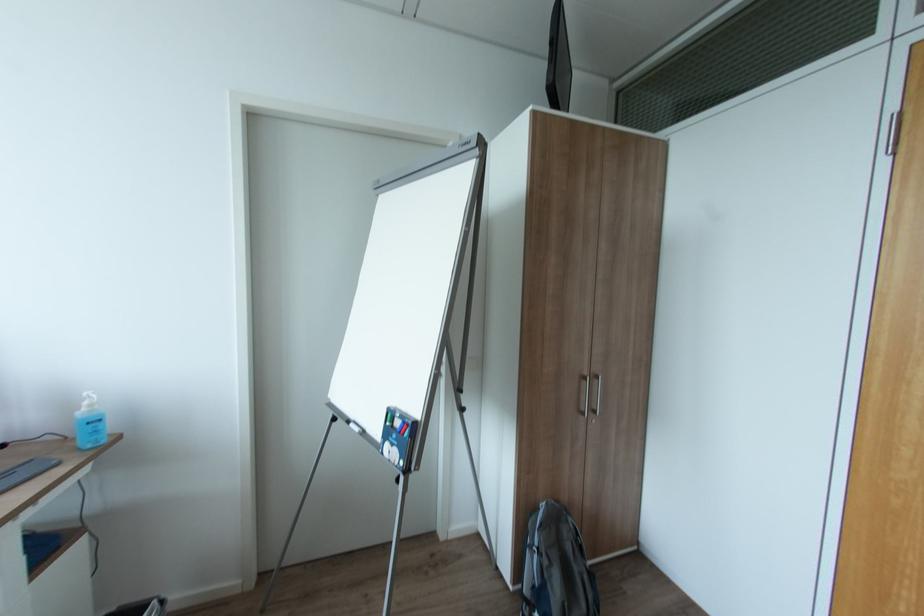
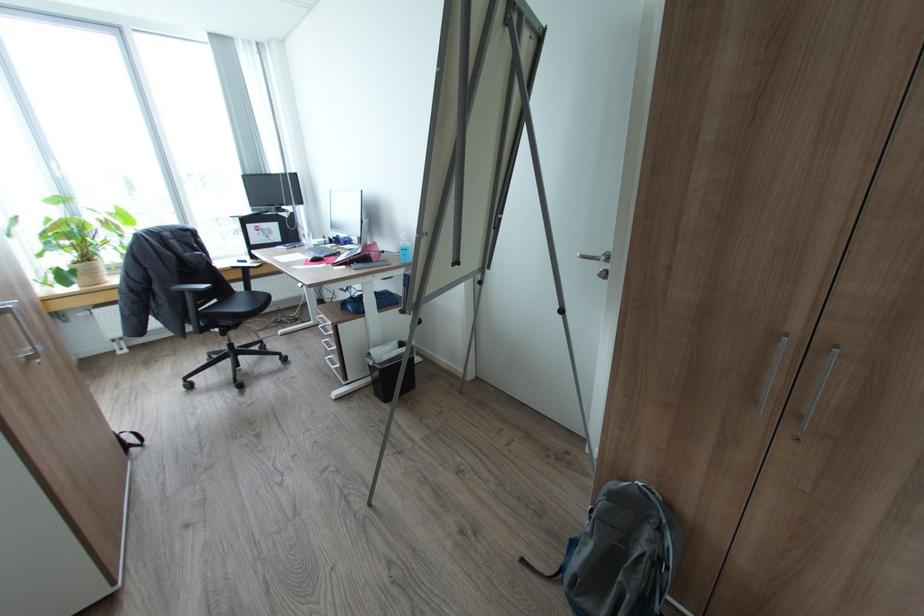
Locate, in the second image, the point that corresponds to the point at 100,432 in the first image.

(408, 254)